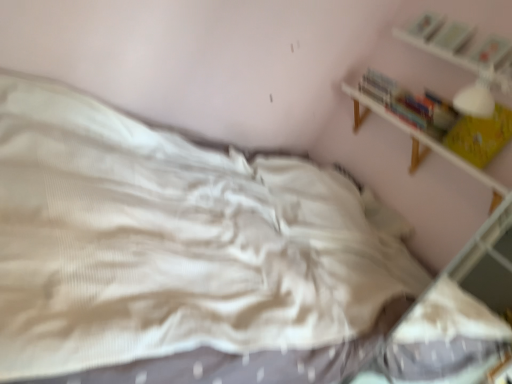
Question: Is white wooden shelf at upper right spatially inside yellow paper book at upper right, positioned as the first book in bottom-to-top order, or outside of it?

Choices:
 (A) outside
 (B) inside

Answer: (A)

Question: Looking at their shapes, would you say white wooden shelf at upper right is wider or thinner than yellow paper book at upper right, positioned as the first book in bottom-to-top order?

Choices:
 (A) wide
 (B) thin

Answer: (A)

Question: Based on their relative distances, which object is farther from the hardcover book at upper right, positioned as the first book in top-to-bottom order?

Choices:
 (A) hardcover book at upper right, which is counted as the 3th book, starting from the top
 (B) white wooden shelf at upper right
 (C) hardcover book at upper right, acting as the third book starting from the bottom
 (D) yellow paper book at upper right, which is the fourth book in top-to-bottom order

Answer: (D)

Question: Based on their relative distances, which object is nearer to the white wooden shelf at upper right?

Choices:
 (A) hardcover book at upper right, which is counted as the 3th book, starting from the top
 (B) hardcover book at upper right, positioned as the 4th book in bottom-to-top order
 (C) hardcover book at upper right, acting as the third book starting from the bottom
 (D) yellow paper book at upper right, which is the fourth book in top-to-bottom order

Answer: (D)